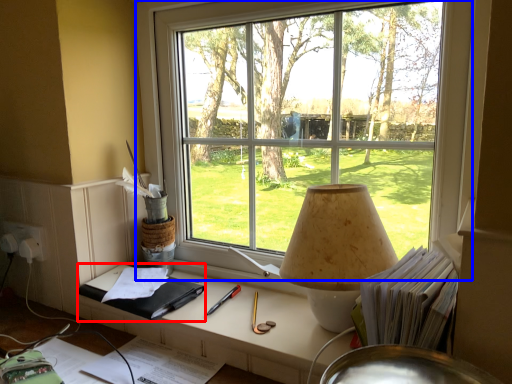
Question: Which of the following is the farthest to the observer, notebook (highlighted by a red box) or window (highlighted by a blue box)?

Choices:
 (A) notebook
 (B) window

Answer: (A)